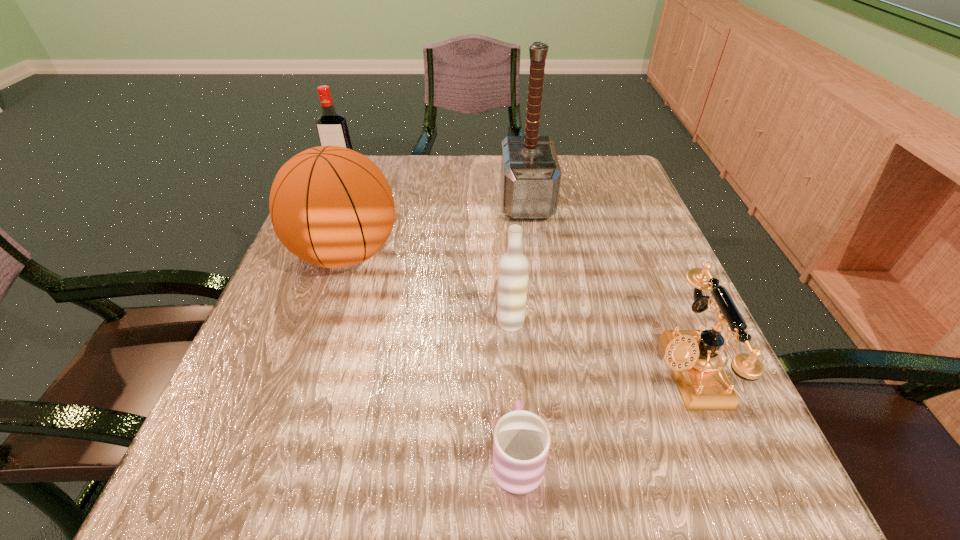
Identify the location of hammer. (530, 177).

Locate an element on the screen. This screenshot has height=540, width=960. the farther vodka is located at coordinates (332, 128).

At what (x,y) coordinates should I click in order to perform the action: click on basketball. Please return your answer as a coordinate pair (x, y). This screenshot has width=960, height=540. Looking at the image, I should click on point(331,206).

In order to click on the right vodka in this screenshot , I will do `click(513, 268)`.

Find the location of a particular element. telephone is located at coordinates (693, 355).

Identify the location of the rightmost object. (693, 355).

Where is `cup`? This screenshot has width=960, height=540. cup is located at coordinates (521, 441).

You are a GUI agent. You are given a task and a screenshot of the screen. Output one action in this format:
    pyautogui.click(x=<x>, y=<y>)
    Task: Click on the vacant space located 0.050m on the back of the hammer
    
    Given the screenshot: What is the action you would take?
    pyautogui.click(x=522, y=170)

Find the location of a particular element. The image size is (960, 540). vacant space positioned 0.180m on the front and back of the farther vodka is located at coordinates (323, 227).

Where is `vacant space located on the right of the basketball`? This screenshot has width=960, height=540. vacant space located on the right of the basketball is located at coordinates (518, 254).